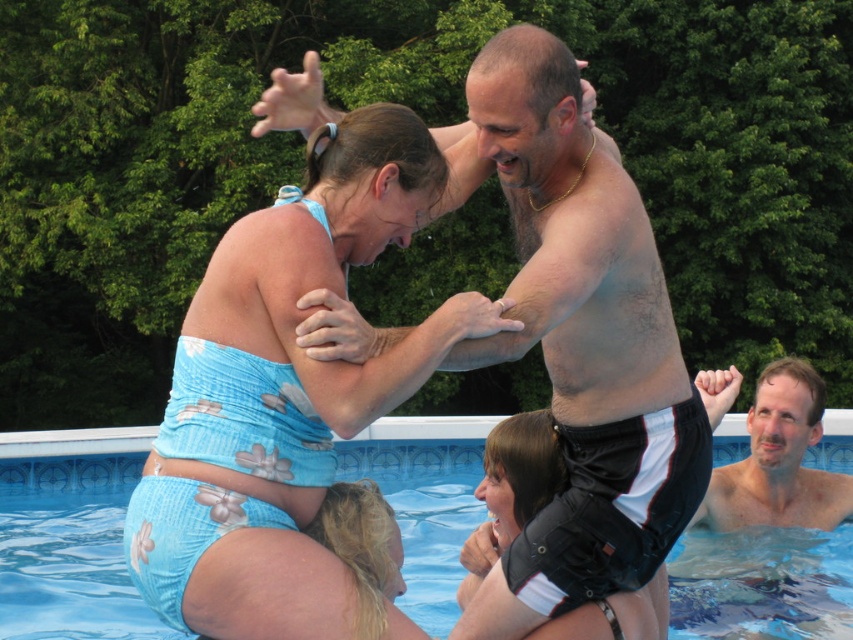
Which is in front, point (229, 385) or point (556, 323)?

Positioned in front is point (229, 385).

Is point (241, 378) behind point (482, 618)?

That is False.

Identify the location of blue floral swimsuit at upper center. This screenshot has width=853, height=640. (283, 392).

Which is more to the left, shiny metallic arm at upper center or smooth skin man at upper right?

From the viewer's perspective, shiny metallic arm at upper center appears more on the left side.

Does shiny metallic arm at upper center come in front of smooth skin man at upper right?

Yes, shiny metallic arm at upper center is in front of smooth skin man at upper right.

What do you see at coordinates (581, 346) in the screenshot?
I see `shiny metallic arm at upper center` at bounding box center [581, 346].

In order to click on shiny metallic arm at upper center in this screenshot , I will do `click(581, 346)`.

Which is more to the left, blue fabric swimming pool at center or smooth skin man at upper right?

blue fabric swimming pool at center is more to the left.

Does blue fabric swimming pool at center have a lesser width compared to smooth skin man at upper right?

Indeed, blue fabric swimming pool at center has a lesser width compared to smooth skin man at upper right.

Does point (136, 625) lie in front of point (822, 470)?

Yes, it is.

Locate an element on the screen. Image resolution: width=853 pixels, height=640 pixels. blue fabric swimming pool at center is located at coordinates (68, 534).